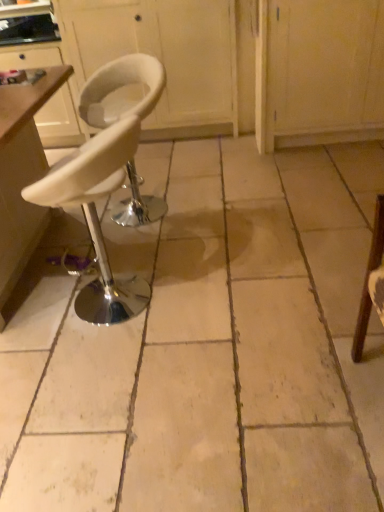
Where is `spots to the right of white plastic table at left`? The width and height of the screenshot is (384, 512). spots to the right of white plastic table at left is located at coordinates (195, 249).